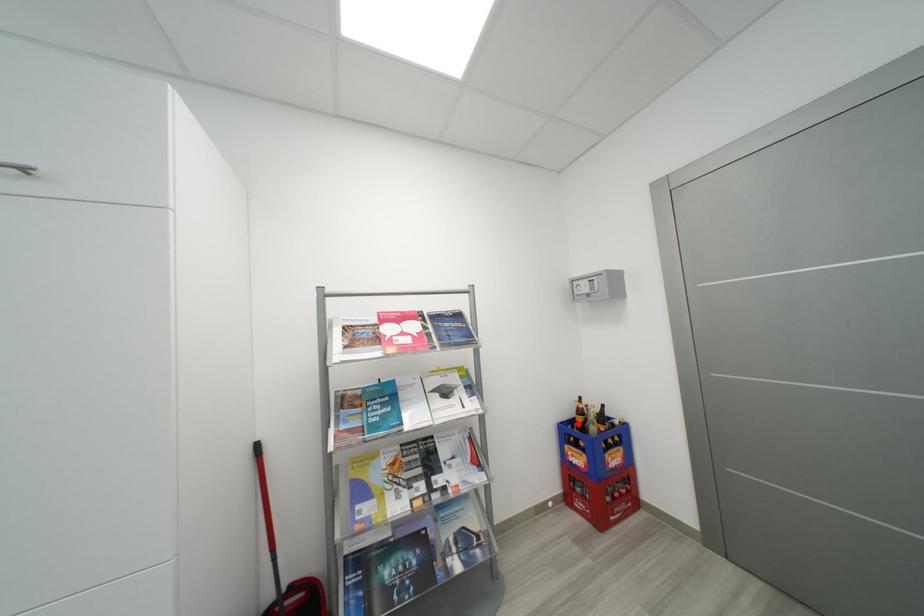
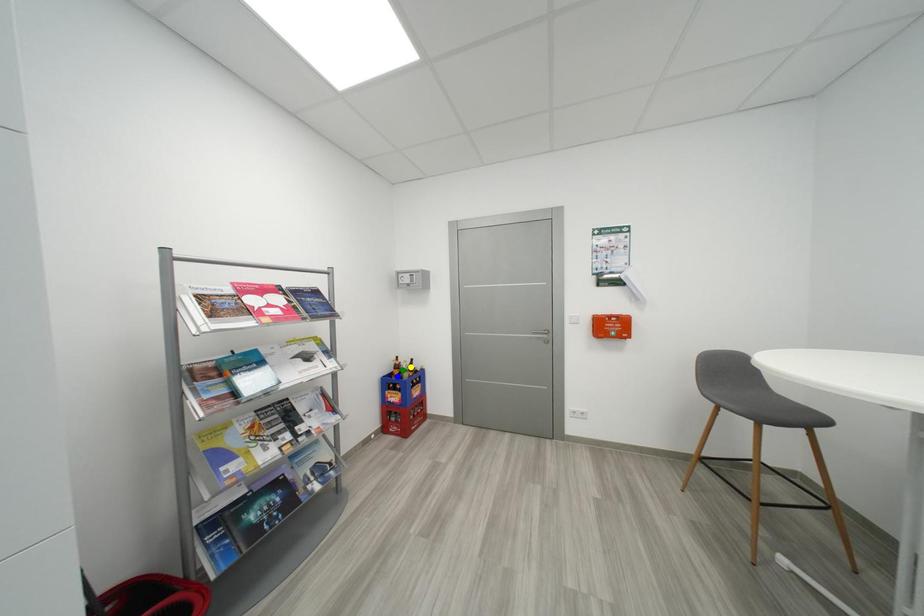
Question: I am providing you with two images of the same scene from different viewpoints. A red point is marked on the first image. You are given multiple points on the second image. Which point in image 2 represents the same 3d spot as the red point in image 1?

Choices:
 (A) blue point
 (B) green point
 (C) yellow point

Answer: (A)